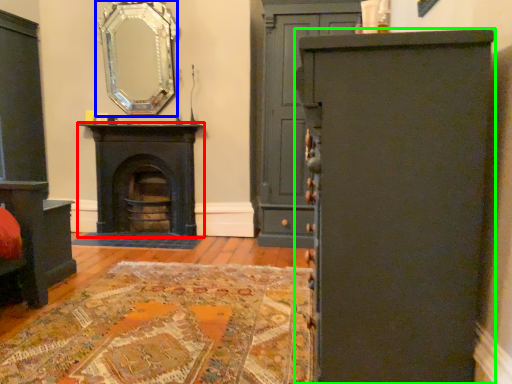
Question: Which object is positioned farthest from fireplace (highlighted by a red box)? Select from mirror (highlighted by a blue box) and cabinetry (highlighted by a green box).

Choices:
 (A) mirror
 (B) cabinetry

Answer: (B)